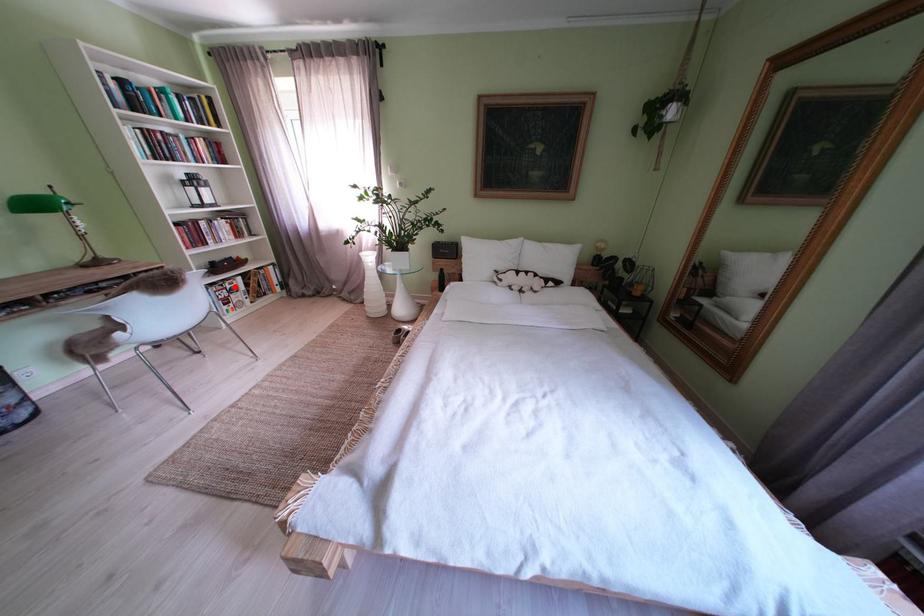
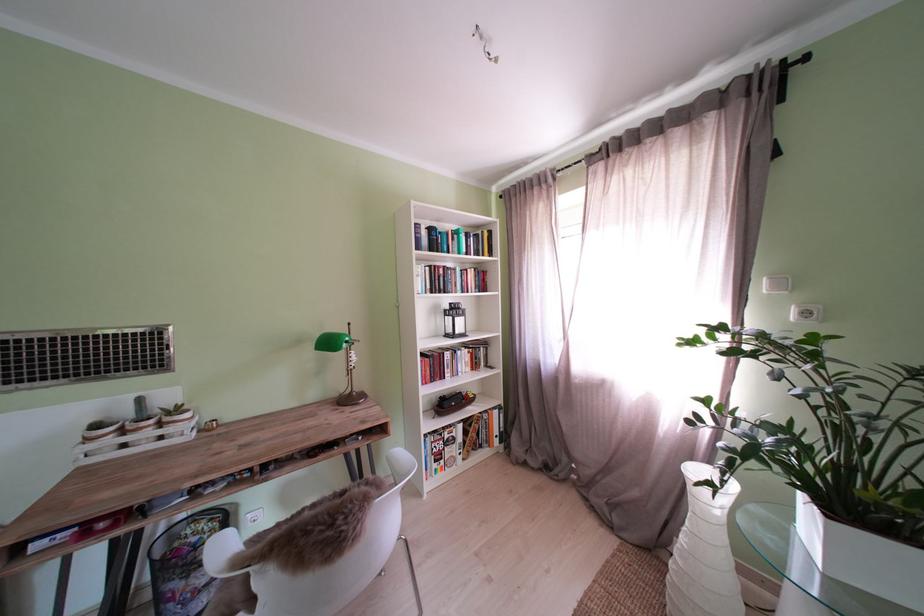
Locate, in the second image, the point that corresponds to the highlighted location in the first image.

(456, 434)